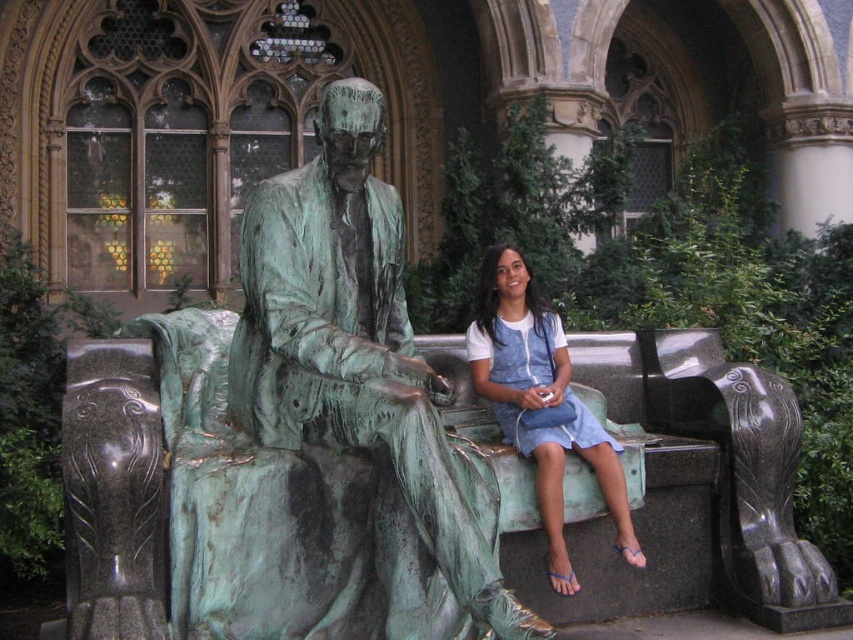
Question: Does green patina bronze statue at center appear on the left side of denim dress at center?

Choices:
 (A) no
 (B) yes

Answer: (B)

Question: Does green patina bronze statue at center appear under denim dress at center?

Choices:
 (A) no
 (B) yes

Answer: (A)

Question: Which point appears closest to the camera in this image?

Choices:
 (A) (514, 262)
 (B) (291, 342)

Answer: (B)

Question: Is green patina bronze statue at center smaller than denim dress at center?

Choices:
 (A) yes
 (B) no

Answer: (B)